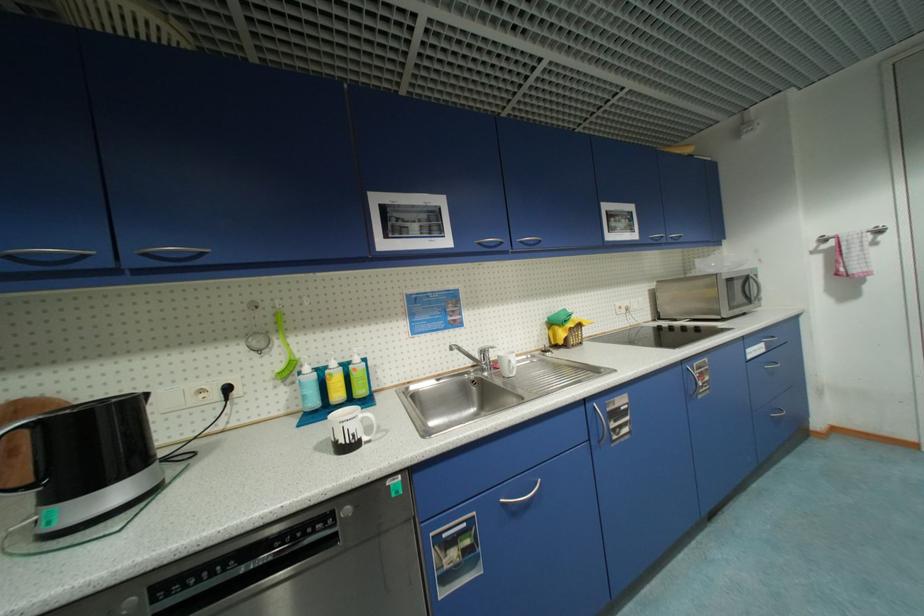
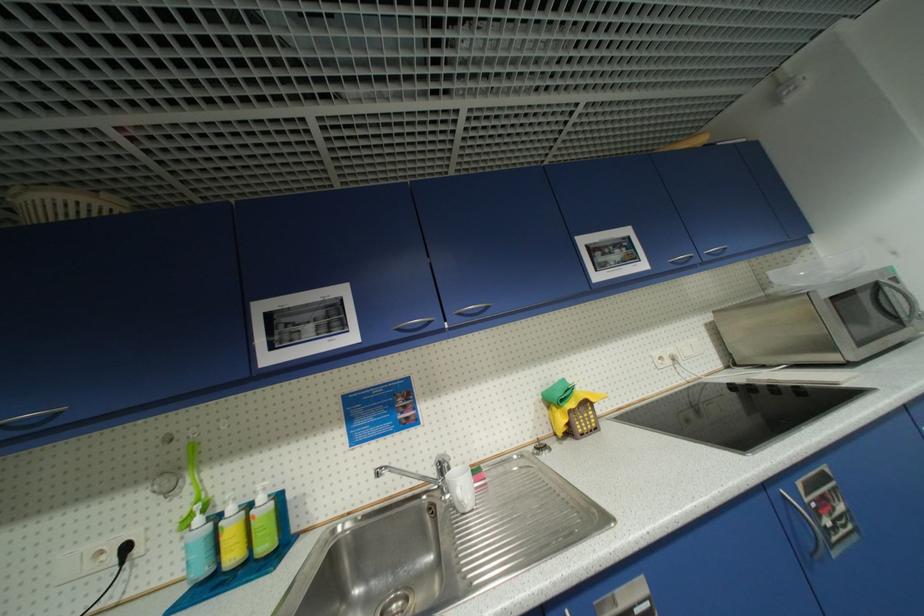
Locate, in the second image, the point that corresponds to (x=338, y=365) in the first image.

(237, 511)